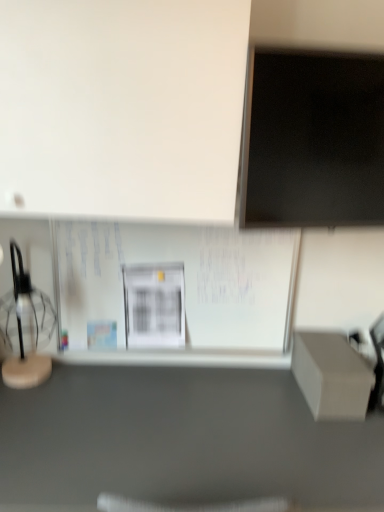
Locate an element on the screen. The height and width of the screenshot is (512, 384). blank area beneath translucent glass table lamp at left (from a real-world perspective) is located at coordinates (30, 380).